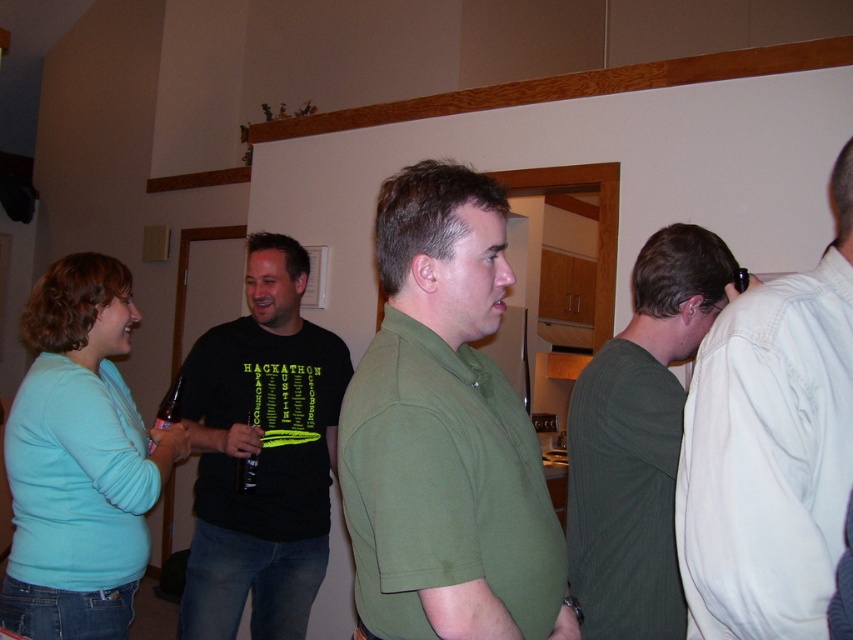
Between green matte shirt at center and dark green sweater at center, which one has less height?

green matte shirt at center is shorter.

Who is taller, green matte shirt at center or dark green sweater at center?

With more height is dark green sweater at center.

Which is behind, point (392, 305) or point (613, 557)?

The point (613, 557) is more distant.

Locate an element on the screen. green matte shirt at center is located at coordinates (445, 433).

Who is shorter, black cotton t-shirt at center or dark green sweater at center?

With less height is dark green sweater at center.

Which is more to the right, black cotton t-shirt at center or dark green sweater at center?

Positioned to the right is dark green sweater at center.

Between point (270, 454) and point (648, 449), which one is positioned behind?

Point (270, 454)

Locate an element on the screen. The image size is (853, 640). black cotton t-shirt at center is located at coordinates (260, 452).

Is green matte shirt at center thinner than black cotton t-shirt at center?

Yes, green matte shirt at center is thinner than black cotton t-shirt at center.

Does point (422, 264) come in front of point (218, 435)?

Yes, point (422, 264) is closer to viewer.

In order to click on green matte shirt at center in this screenshot , I will do `click(445, 433)`.